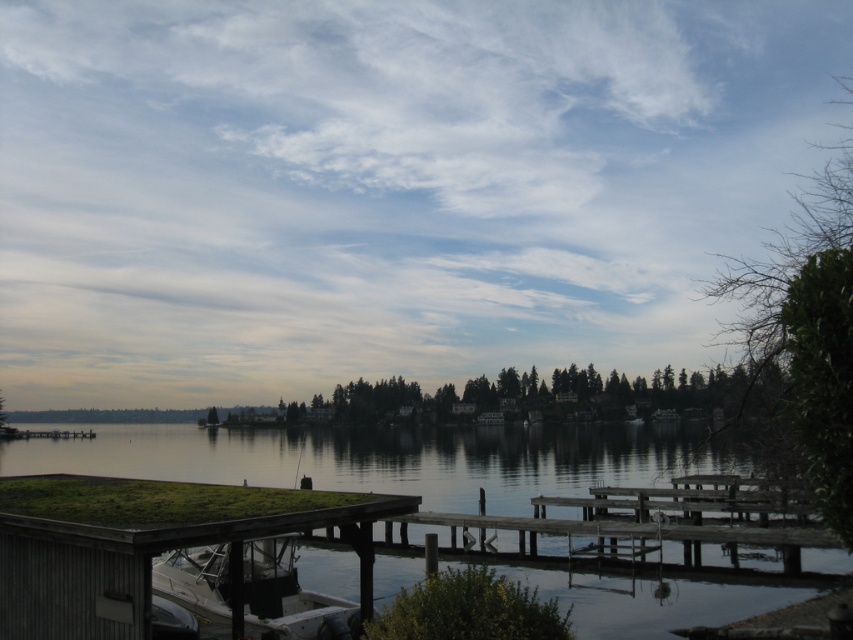
Question: Can you confirm if clear water at lower center is thinner than white matte boat at lower left?

Choices:
 (A) no
 (B) yes

Answer: (A)

Question: Can you confirm if clear water at lower center is bigger than white matte boat at lower left?

Choices:
 (A) yes
 (B) no

Answer: (A)

Question: In this image, where is clear water at lower center located relative to white matte boat at lower left?

Choices:
 (A) above
 (B) below

Answer: (B)